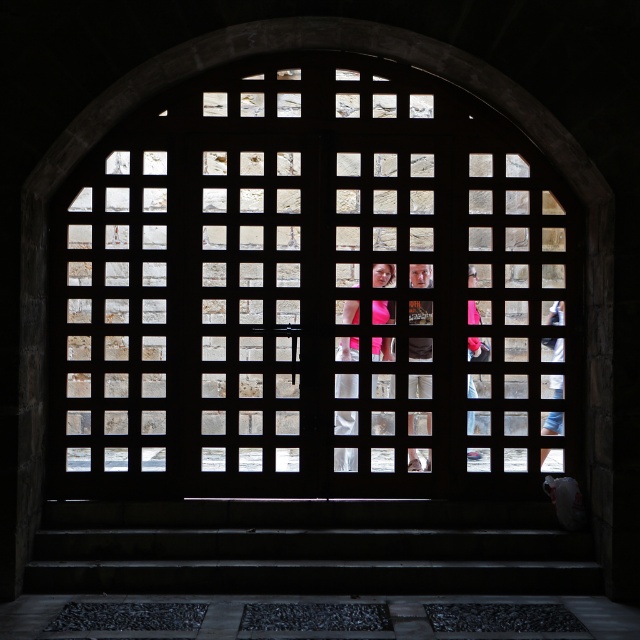
Is point (497, 442) positioned in front of point (348, 387)?

Yes.

Does wooden lattice at center have a lesser width compared to matte pink dress at center?

Incorrect, wooden lattice at center's width is not less than matte pink dress at center's.

Is point (122, 445) more distant than point (346, 308)?

That is False.

Identify the location of wooden lattice at center. The image size is (640, 640). (307, 291).

Who is higher up, matte pink dress at center or pink fabric at center?

Positioned higher is pink fabric at center.

In the scene shown: Is matte pink dress at center thinner than pink fabric at center?

No, matte pink dress at center is not thinner than pink fabric at center.

Is point (384, 280) positioned after point (474, 285)?

Yes, it is.

You are a GUI agent. You are given a task and a screenshot of the screen. Output one action in this format:
    pyautogui.click(x=<x>, y=<y>)
    Task: Click on the matte pink dress at center
    
    Given the screenshot: What is the action you would take?
    pyautogui.click(x=346, y=460)

Find the location of a particular element. wooden lattice at center is located at coordinates (307, 291).

Locate an element on the screen. wooden lattice at center is located at coordinates (307, 291).